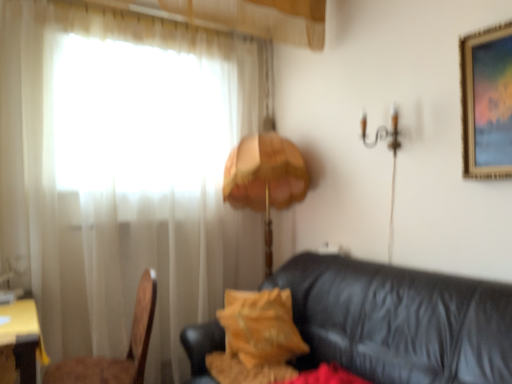
Question: Is yellow wood table at lower left facing towards white sheer curtain at left?

Choices:
 (A) no
 (B) yes

Answer: (A)

Question: Can you confirm if yellow wood table at lower left is smaller than white sheer curtain at left?

Choices:
 (A) no
 (B) yes

Answer: (B)

Question: Would you say yellow wood table at lower left contains white sheer curtain at left?

Choices:
 (A) yes
 (B) no

Answer: (B)

Question: Is yellow wood table at lower left far from white sheer curtain at left?

Choices:
 (A) yes
 (B) no

Answer: (A)

Question: From a real-world perspective, does yellow wood table at lower left stand above white sheer curtain at left?

Choices:
 (A) yes
 (B) no

Answer: (B)

Question: Visually, is velvet yellow pillow at center positioned to the left or to the right of orange fabric lampshade at center?

Choices:
 (A) left
 (B) right

Answer: (A)

Question: From the image's perspective, is velvet yellow pillow at center above or below orange fabric lampshade at center?

Choices:
 (A) above
 (B) below

Answer: (B)

Question: Considering the positions of velvet yellow pillow at center and orange fabric lampshade at center in the image, is velvet yellow pillow at center wider or thinner than orange fabric lampshade at center?

Choices:
 (A) wide
 (B) thin

Answer: (B)

Question: Is point (276, 334) closer or farther from the camera than point (276, 188)?

Choices:
 (A) closer
 (B) farther

Answer: (A)

Question: Based on their sizes in the image, would you say orange fabric lampshade at center is bigger or smaller than wooden chair at left?

Choices:
 (A) big
 (B) small

Answer: (A)

Question: Is orange fabric lampshade at center taller or shorter than wooden chair at left?

Choices:
 (A) short
 (B) tall

Answer: (B)

Question: Is point (295, 170) positioned closer to the camera than point (141, 332)?

Choices:
 (A) closer
 (B) farther

Answer: (B)

Question: Considering the relative positions of orange fabric lampshade at center and wooden chair at left in the image provided, is orange fabric lampshade at center to the left or to the right of wooden chair at left?

Choices:
 (A) right
 (B) left

Answer: (A)

Question: From the image's perspective, relative to velvet yellow pillow at center, is white sheer curtain at left above or below?

Choices:
 (A) above
 (B) below

Answer: (A)

Question: Visually, is white sheer curtain at left positioned to the left or to the right of velvet yellow pillow at center?

Choices:
 (A) right
 (B) left

Answer: (B)